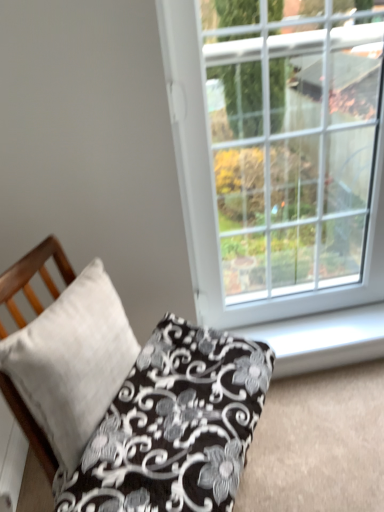
Question: Would you say white plastic window at upper right contains satin white pillow at lower left, which is the 2th pillow in left-to-right order?

Choices:
 (A) no
 (B) yes

Answer: (A)

Question: Does white plastic window at upper right have a lesser width compared to satin white pillow at lower left, which ranks as the 1th pillow in right-to-left order?

Choices:
 (A) yes
 (B) no

Answer: (A)

Question: From a real-world perspective, is white plastic window at upper right physically below satin white pillow at lower left, which is the 2th pillow in left-to-right order?

Choices:
 (A) no
 (B) yes

Answer: (A)

Question: Is there a large distance between white plastic window at upper right and satin white pillow at lower left, which is the 2th pillow in left-to-right order?

Choices:
 (A) yes
 (B) no

Answer: (B)

Question: Is white plastic window at upper right touching satin white pillow at lower left, which ranks as the 1th pillow in right-to-left order?

Choices:
 (A) no
 (B) yes

Answer: (A)

Question: Considering the positions of point (190, 391) and point (284, 336), is point (190, 391) closer or farther from the camera than point (284, 336)?

Choices:
 (A) farther
 (B) closer

Answer: (B)

Question: From the image's perspective, is satin white pillow at lower left, which is the 2th pillow in left-to-right order, positioned above or below white plastic window sill at lower right?

Choices:
 (A) below
 (B) above

Answer: (A)

Question: In the image, is satin white pillow at lower left, which is the 2th pillow in left-to-right order, on the left side or the right side of white plastic window sill at lower right?

Choices:
 (A) left
 (B) right

Answer: (A)

Question: Is satin white pillow at lower left, which ranks as the 1th pillow in right-to-left order, in front of or behind white plastic window sill at lower right in the image?

Choices:
 (A) front
 (B) behind

Answer: (A)

Question: Is white plastic window at upper right spatially inside white matte pillow at left, which is the first pillow from left to right, or outside of it?

Choices:
 (A) inside
 (B) outside

Answer: (B)

Question: Is white plastic window at upper right wider or thinner than white matte pillow at left, positioned as the 2th pillow in right-to-left order?

Choices:
 (A) wide
 (B) thin

Answer: (A)

Question: From a real-world perspective, relative to white matte pillow at left, positioned as the 2th pillow in right-to-left order, is white plastic window at upper right vertically above or below?

Choices:
 (A) below
 (B) above

Answer: (B)

Question: Would you say white plastic window at upper right is to the left or to the right of white matte pillow at left, which is the first pillow from left to right, in the picture?

Choices:
 (A) right
 (B) left

Answer: (A)

Question: In the image, is satin white pillow at lower left, which is the 2th pillow in left-to-right order, on the left side or the right side of white matte pillow at left, which is the first pillow from left to right?

Choices:
 (A) right
 (B) left

Answer: (A)

Question: Considering the positions of satin white pillow at lower left, which ranks as the 1th pillow in right-to-left order, and white matte pillow at left, positioned as the 2th pillow in right-to-left order, in the image, is satin white pillow at lower left, which ranks as the 1th pillow in right-to-left order, bigger or smaller than white matte pillow at left, positioned as the 2th pillow in right-to-left order,?

Choices:
 (A) big
 (B) small

Answer: (A)